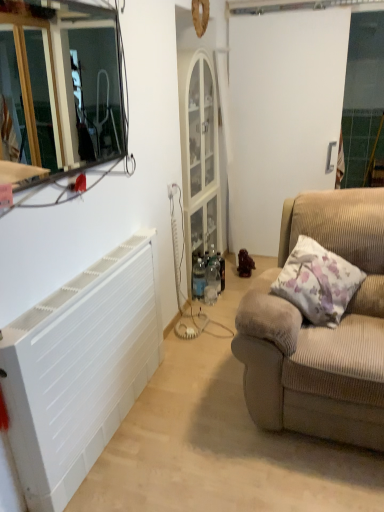
Identify the location of vacant space underneath white plastic radiator at left (from a real-world perspective). Image resolution: width=384 pixels, height=512 pixels. (126, 414).